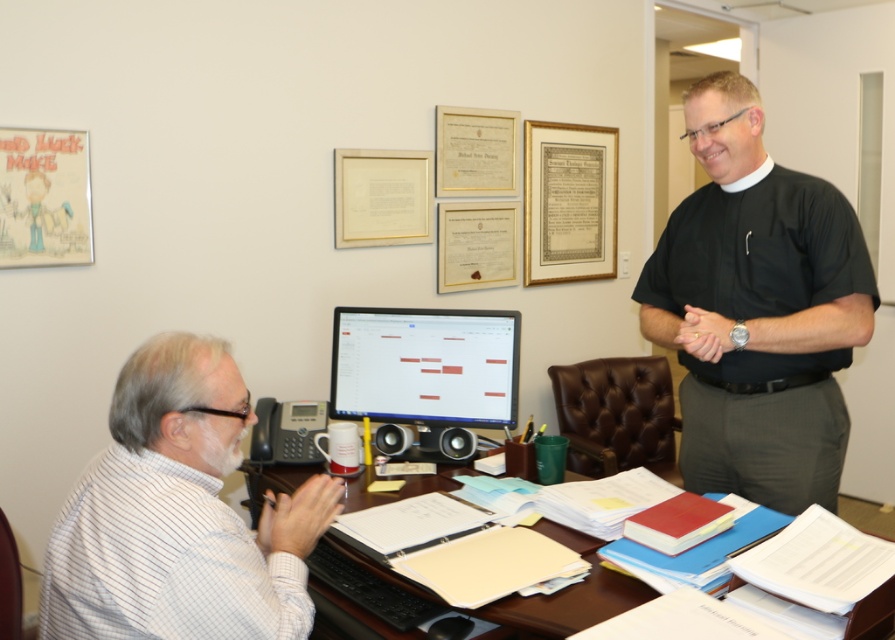
You are an office worker who needs to locate the white striped shirt at left in the scene. Based on the coordinates provided, where would you find it?

The white striped shirt at left is located at the coordinates point (179, 515).

You are a delivery person who needs to place a package on the desk between the white striped shirt at left and the matte black monitor at center. The package is 18 inches long. Is there enough space between them to place the package?

The distance between the white striped shirt at left and the matte black monitor at center is 33.04 inches, which is more than enough to accommodate the 18 inch package.